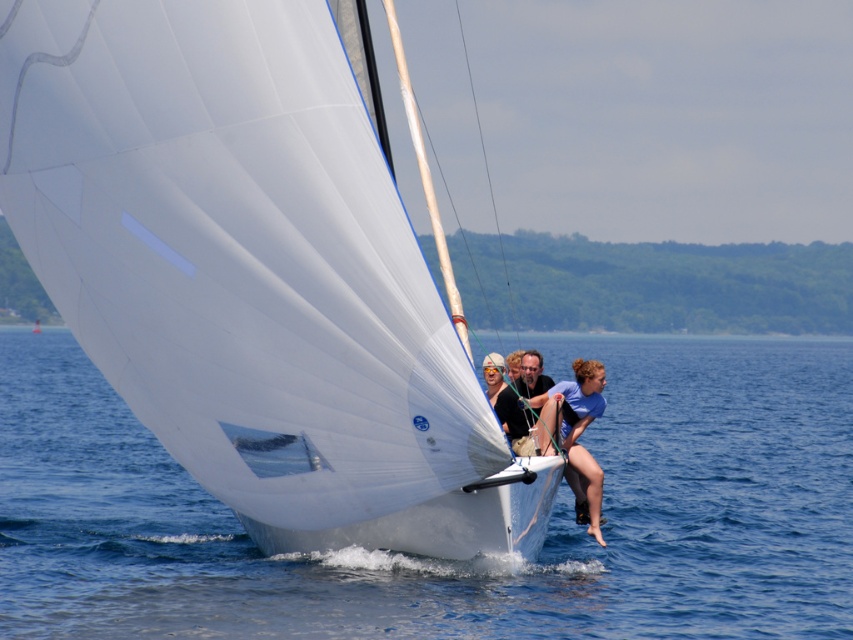
You are a photographer trying to capture the white matte sailboat at center and the blue water at sailboat right in a single shot. Based on their positions, which object should you focus on first to ensure both are in the frame?

The white matte sailboat at center is positioned on the right side of blue water at sailboat right. To capture both in a single shot, focus on the white matte sailboat at center first since it is closer to the right edge, ensuring the blue water at sailboat right remains within the frame.

You are a passenger on the sailboat and need to locate the exact position of point (253, 272). Where exactly is this point located on the sailboat?

The point (253, 272) is located on the white matte sailboat at center.